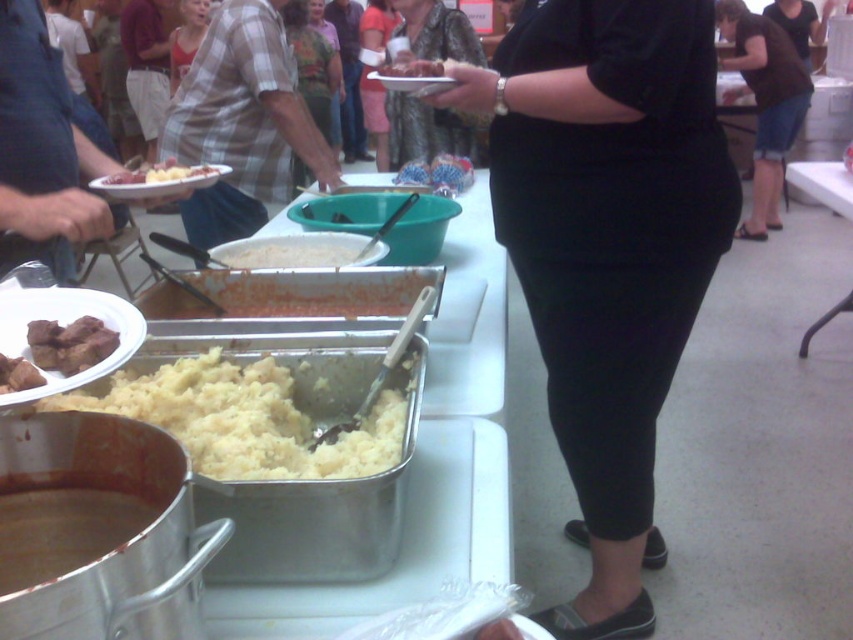
You are organizing a clothing donation drive and need to determine if the leather jacket at center can fit into a donation box that is the same width as the brown matte meat at left. Based on the scene, can the jacket fit?

The leather jacket at center might be wider than brown matte meat at left, so it may not fit into the donation box designed for the width of the brown matte meat at left.

You are a guest at the event and want to know which item is shorter between the brown matte meat at center and the matte black shirt at center. Which one is shorter?

The brown matte meat at center is shorter than the matte black shirt at center.

You are at a community event and want to grab some food. You see the yellow mashed potato at center and the matte white shirt at upper left. Which item is closer to you?

The yellow mashed potato at center is closer to you because it is in front of the matte white shirt at upper left.